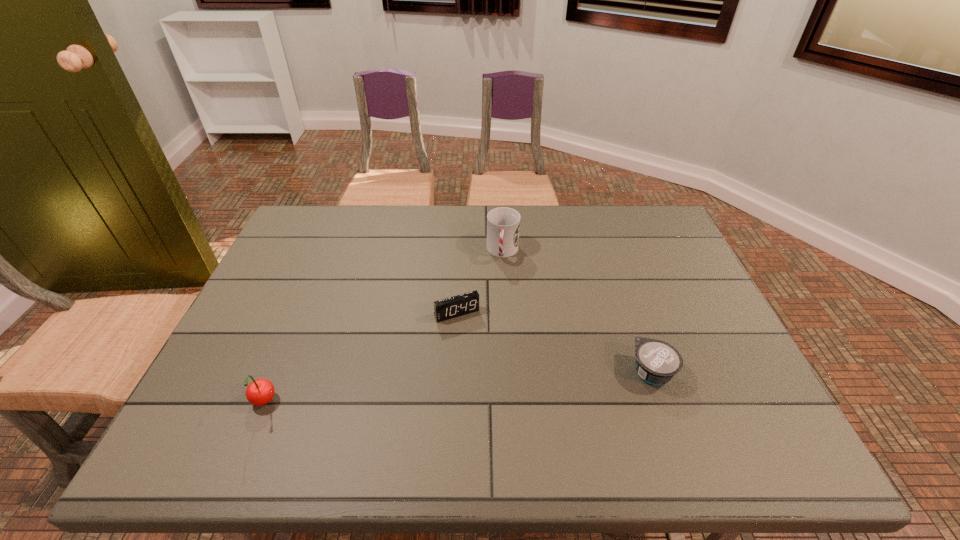
In the image, there is a desktop. At what (x,y) coordinates should I click in order to perform the action: click on free region at the near edge. Please return your answer as a coordinate pair (x, y). This screenshot has height=540, width=960. Looking at the image, I should click on (677, 382).

Where is `vacant point at the right edge`? vacant point at the right edge is located at coordinates tap(697, 300).

This screenshot has width=960, height=540. Identify the location of vacant space at the far left corner. (330, 237).

This screenshot has height=540, width=960. Find the location of `vacant space at the far right corner`. vacant space at the far right corner is located at coordinates (660, 221).

In order to click on free region at the near right corner in this screenshot , I will do `click(701, 397)`.

In order to click on vacant area between the second farthest object and the rightmost object in this screenshot , I will do `click(554, 342)`.

What are the coordinates of `empty location between the cherry and the rightmost object` in the screenshot? It's located at (458, 387).

Where is `empty space that is in between the yogurt and the cherry`? This screenshot has width=960, height=540. empty space that is in between the yogurt and the cherry is located at coordinates (458, 387).

This screenshot has height=540, width=960. I want to click on empty location between the yogurt and the cherry, so click(x=458, y=387).

Where is `free space between the third object from right to left and the cup`? free space between the third object from right to left and the cup is located at coordinates (480, 282).